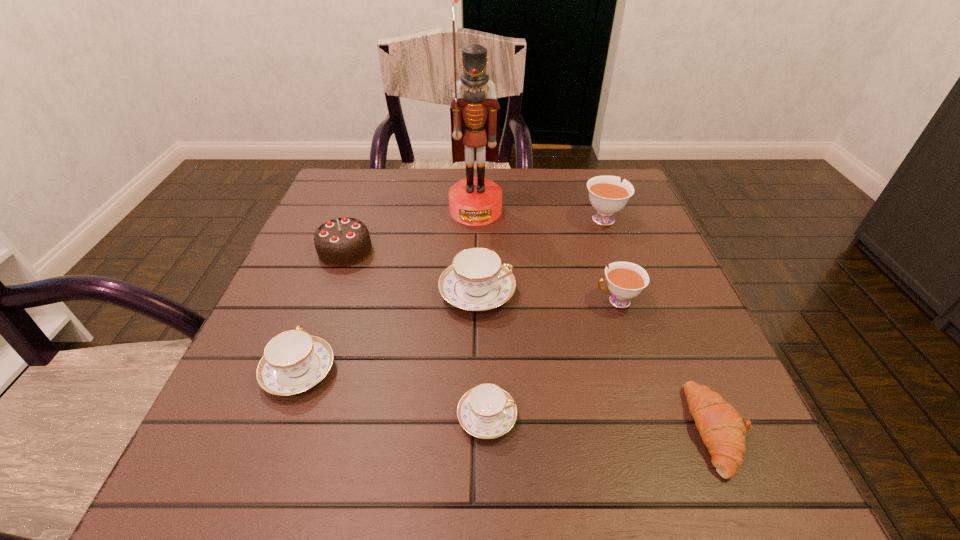
I want to click on the shortest teacup, so click(486, 411).

Where is `crescent roll`? crescent roll is located at coordinates (x=721, y=427).

In order to click on blank area located on the front-facing side of the tallest object in this screenshot , I will do `click(474, 316)`.

Locate an element on the screen. This screenshot has height=540, width=960. vacant point located 0.130m on the side of the bigger white teacup with the handle is located at coordinates (588, 178).

This screenshot has height=540, width=960. Find the location of `vacant space located 0.140m on the side of the bigger white teacup with the handle`. vacant space located 0.140m on the side of the bigger white teacup with the handle is located at coordinates (588, 177).

Locate an element on the screen. The height and width of the screenshot is (540, 960). blank space located on the back of the sixth nearest object is located at coordinates (366, 193).

Identify the location of free space located on the side with the handle of the biggest blue teacup. (576, 293).

Find the location of a particular element. The width and height of the screenshot is (960, 540). free space located on the side of the smaller white teacup with the handle is located at coordinates (552, 301).

Where is `vacant space located 0.380m on the side of the smaller white teacup with the handle`? vacant space located 0.380m on the side of the smaller white teacup with the handle is located at coordinates (397, 301).

In order to click on vacant space situated 0.060m on the side of the smaller white teacup with the handle in this screenshot , I will do `click(563, 301)`.